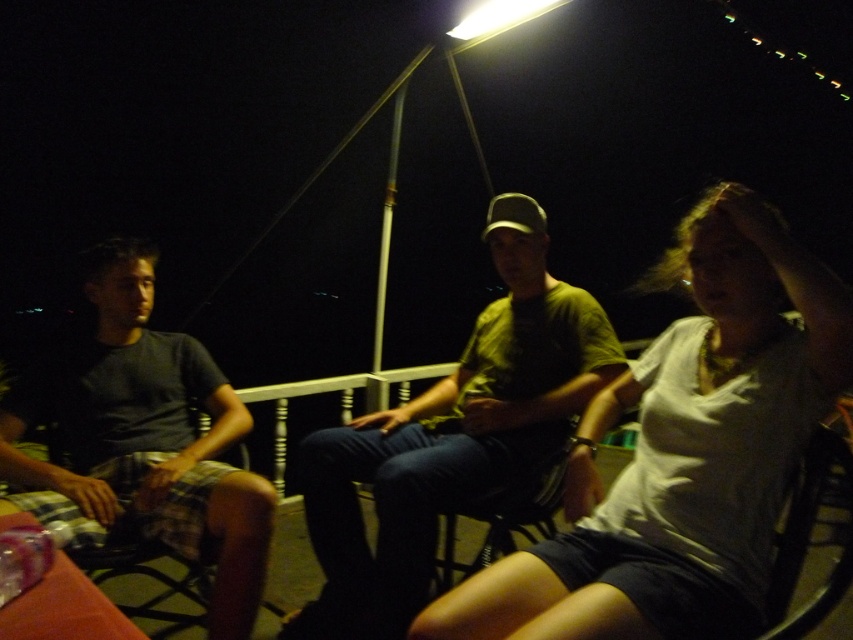
You are standing on the balcony and want to move from the point at coordinates point (x=842, y=349) to the point at coordinates point (x=393, y=488). Which direction should you move to reach your destination?

You should move backward because point (x=842, y=349) is in front of point (x=393, y=488), meaning the destination is behind your current position.

You are standing on the balcony and want to place a small lamp exactly where the green matte shirt at center is located. What are the coordinates you should use?

The coordinates for the green matte shirt at center are 0.684 in the x direction and 0.531 in the y direction.